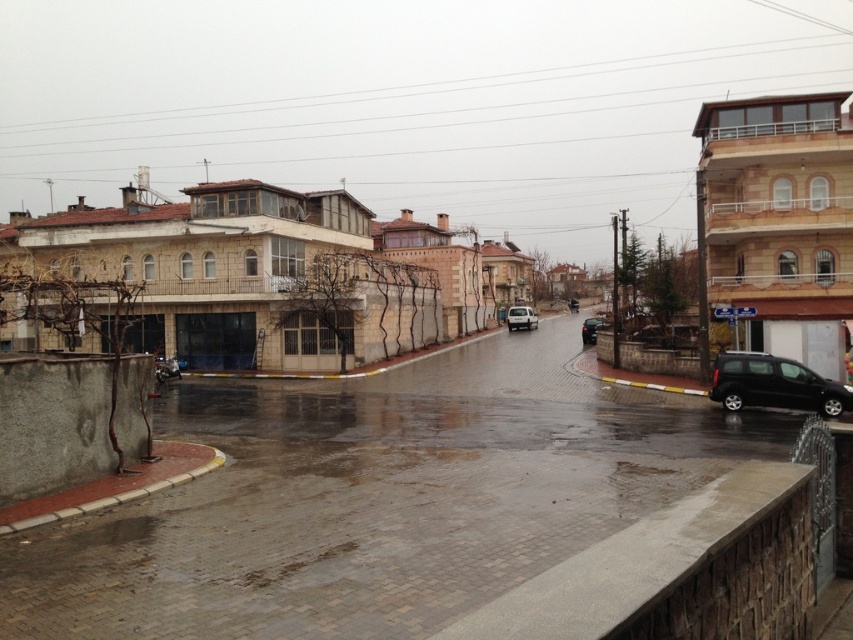
Who is more distant from viewer, [461,579] or [590,342]?

Positioned behind is point [590,342].

Looking at this image, is wet concrete pavement at lower center thinner than shiny black car at right?

In fact, wet concrete pavement at lower center might be wider than shiny black car at right.

Which is behind, point (618, 516) or point (607, 323)?

The point (607, 323) is more distant.

What are the coordinates of `wet concrete pavement at lower center` in the screenshot? It's located at (375, 499).

Is white matte van at center further to camera compared to matte black car at center?

No, it is not.

Can you confirm if white matte van at center is thinner than matte black car at center?

Yes, white matte van at center is thinner than matte black car at center.

Locate an element on the screen. The height and width of the screenshot is (640, 853). white matte van at center is located at coordinates 521,317.

Who is more forward, (x=4, y=595) or (x=523, y=321)?

Point (x=4, y=595) is in front.

Is point (592, 492) farther from camera compared to point (515, 307)?

No, (592, 492) is in front of (515, 307).

The width and height of the screenshot is (853, 640). I want to click on wet concrete pavement at lower center, so click(x=375, y=499).

The width and height of the screenshot is (853, 640). Find the location of `wet concrete pavement at lower center`. wet concrete pavement at lower center is located at coordinates (375, 499).